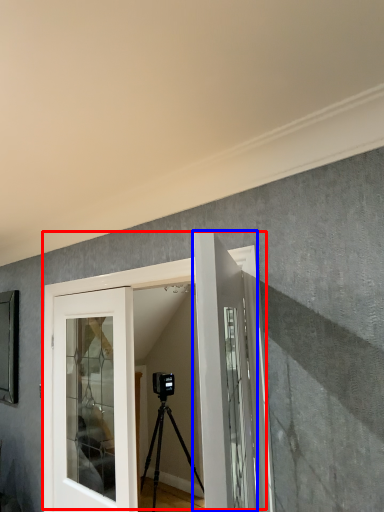
Question: Which object is closer to the camera taking this photo, door (highlighted by a red box) or door (highlighted by a blue box)?

Choices:
 (A) door
 (B) door

Answer: (B)